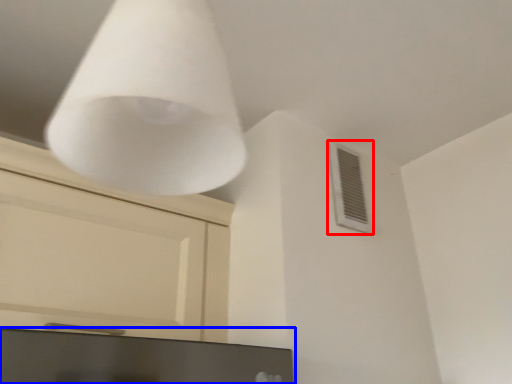
Question: Which of the following is the closest to the observer, air conditioning (highlighted by a red box) or computer monitor (highlighted by a blue box)?

Choices:
 (A) air conditioning
 (B) computer monitor

Answer: (B)